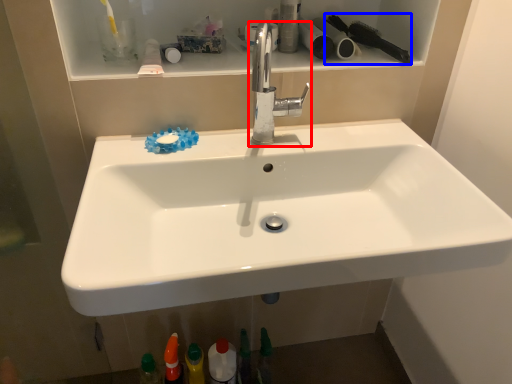
Question: Which point is closer to the camera, tap (highlighted by a red box) or brush (highlighted by a blue box)?

Choices:
 (A) tap
 (B) brush

Answer: (A)